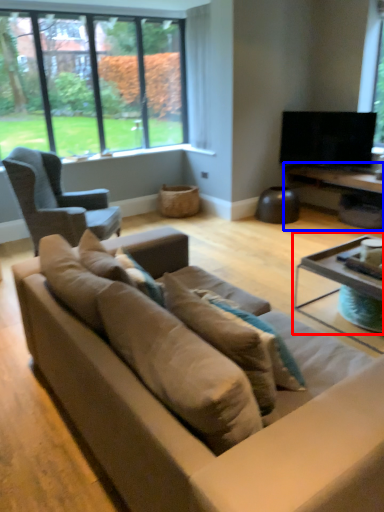
Question: Which of the following is the closest to the observer, coffee table (highlighted by a red box) or table (highlighted by a blue box)?

Choices:
 (A) coffee table
 (B) table

Answer: (A)